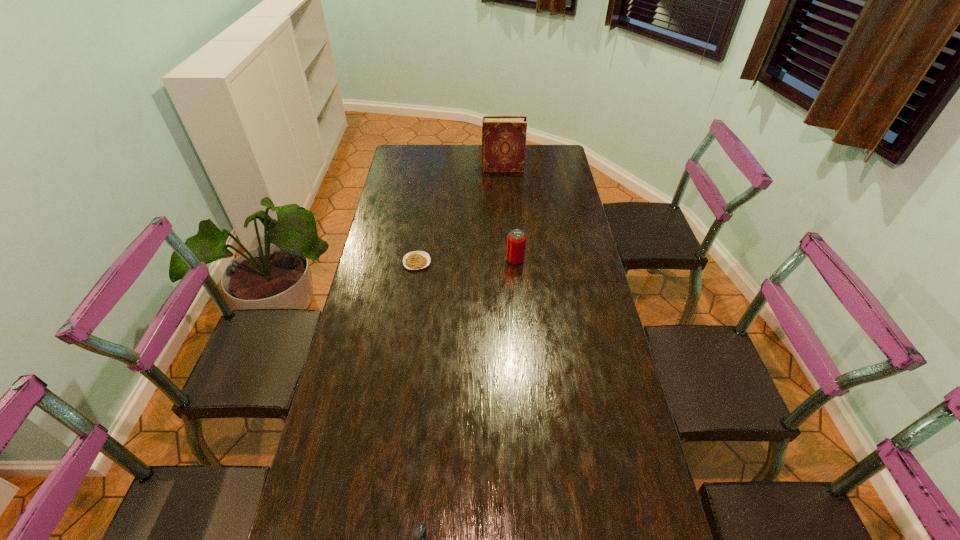
The image size is (960, 540). In order to click on object present at the far edge in this screenshot , I will do `click(503, 137)`.

The width and height of the screenshot is (960, 540). I want to click on object positioned at the left edge, so click(414, 260).

Find the location of a particular element. vacant space at the far edge of the desktop is located at coordinates (481, 144).

Where is `vacant area at the left edge`? The height and width of the screenshot is (540, 960). vacant area at the left edge is located at coordinates (364, 352).

The width and height of the screenshot is (960, 540). Find the location of `free space at the right edge`. free space at the right edge is located at coordinates (559, 272).

Locate an element on the screen. Image resolution: width=960 pixels, height=540 pixels. free space at the far right corner is located at coordinates (539, 167).

Where is `free space between the second tallest object and the leftmost object`? The height and width of the screenshot is (540, 960). free space between the second tallest object and the leftmost object is located at coordinates click(466, 261).

The image size is (960, 540). I want to click on vacant region between the second tallest object and the leftmost object, so click(466, 261).

Where is `vacant space in between the tallest object and the second tallest object`? The height and width of the screenshot is (540, 960). vacant space in between the tallest object and the second tallest object is located at coordinates (509, 215).

You are a GUI agent. You are given a task and a screenshot of the screen. Output one action in this format:
    pyautogui.click(x=<x>, y=<y>)
    Task: Click on the vacant area that lies between the second tallest object and the third tallest object
    This screenshot has height=540, width=960.
    Given the screenshot: What is the action you would take?
    tap(466, 261)